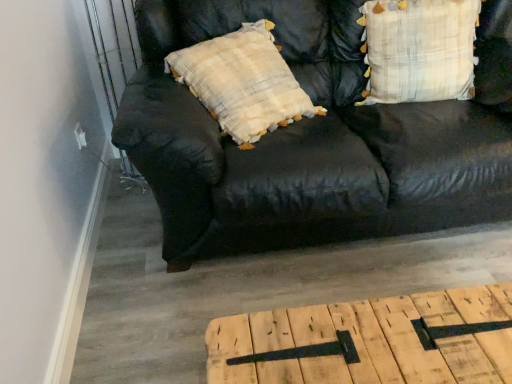
Locate an element on the screen. The width and height of the screenshot is (512, 384). empty space that is ontop of light brown wood table at lower center (from a real-world perspective) is located at coordinates (389, 337).